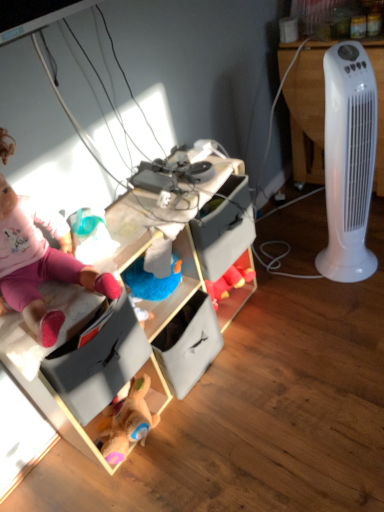
Question: Does wooden toy storage at center contain pink fabric doll at upper left?

Choices:
 (A) yes
 (B) no

Answer: (B)

Question: From the image's perspective, does wooden toy storage at center appear higher than pink fabric doll at upper left?

Choices:
 (A) yes
 (B) no

Answer: (B)

Question: Is wooden toy storage at center next to pink fabric doll at upper left?

Choices:
 (A) no
 (B) yes

Answer: (A)

Question: From a real-world perspective, is wooden toy storage at center positioned under pink fabric doll at upper left based on gravity?

Choices:
 (A) no
 (B) yes

Answer: (B)

Question: Can you confirm if wooden toy storage at center is shorter than pink fabric doll at upper left?

Choices:
 (A) yes
 (B) no

Answer: (B)

Question: Is pink fabric doll at upper left to the left or to the right of white plastic tower fan at right in the image?

Choices:
 (A) right
 (B) left

Answer: (B)

Question: In the image, is pink fabric doll at upper left positioned in front of or behind white plastic tower fan at right?

Choices:
 (A) front
 (B) behind

Answer: (A)

Question: From the image's perspective, is pink fabric doll at upper left above or below white plastic tower fan at right?

Choices:
 (A) above
 (B) below

Answer: (B)

Question: Do you think pink fabric doll at upper left is within white plastic tower fan at right, or outside of it?

Choices:
 (A) inside
 (B) outside

Answer: (B)

Question: Is wooden toy storage at center inside the boundaries of white plastic tower fan at right, or outside?

Choices:
 (A) outside
 (B) inside

Answer: (A)

Question: From the image's perspective, is wooden toy storage at center located above or below white plastic tower fan at right?

Choices:
 (A) above
 (B) below

Answer: (B)

Question: In terms of width, does wooden toy storage at center look wider or thinner when compared to white plastic tower fan at right?

Choices:
 (A) wide
 (B) thin

Answer: (B)

Question: Would you say wooden toy storage at center is to the left or to the right of white plastic tower fan at right in the picture?

Choices:
 (A) right
 (B) left

Answer: (B)

Question: From the image's perspective, relative to white plastic tower fan at right, is pink fabric doll at upper left above or below?

Choices:
 (A) above
 (B) below

Answer: (B)

Question: Is pink fabric doll at upper left inside or outside of white plastic tower fan at right?

Choices:
 (A) outside
 (B) inside

Answer: (A)